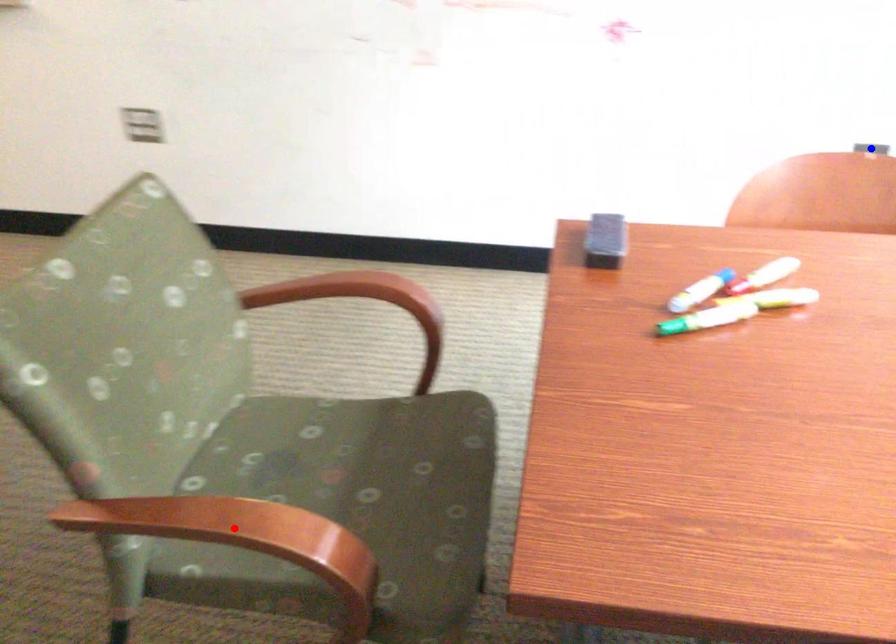
Question: In the image, two points are highlighted. Which point is nearer to the camera? Reply with the corresponding letter.

Choices:
 (A) blue point
 (B) red point

Answer: (B)